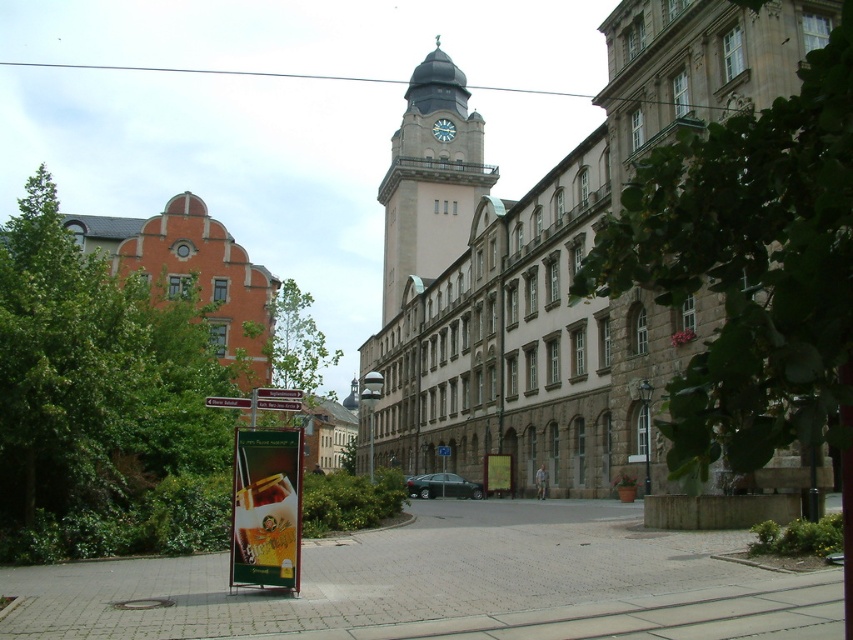
Question: Considering the relative positions of red plastic sign at center and metallic signpost at center in the image provided, where is red plastic sign at center located with respect to metallic signpost at center?

Choices:
 (A) left
 (B) right

Answer: (B)

Question: Which of the following is the closest to the observer?

Choices:
 (A) (451, 67)
 (B) (833, 193)
 (C) (292, 582)
 (D) (288, 410)

Answer: (B)

Question: Which of the following is the farthest from the observer?

Choices:
 (A) red plastic sign at center
 (B) metallic street sign at center
 (C) green plastic sign at lower left

Answer: (A)

Question: Which object appears closest to the camera in this image?

Choices:
 (A) smooth stone clock tower at center
 (B) metallic signpost at center
 (C) white plastic sign at center

Answer: (B)

Question: Does white plastic sign at center have a larger size compared to metallic signpost at center?

Choices:
 (A) yes
 (B) no

Answer: (B)

Question: Is metallic street sign at center bigger than red plastic sign at center?

Choices:
 (A) no
 (B) yes

Answer: (A)